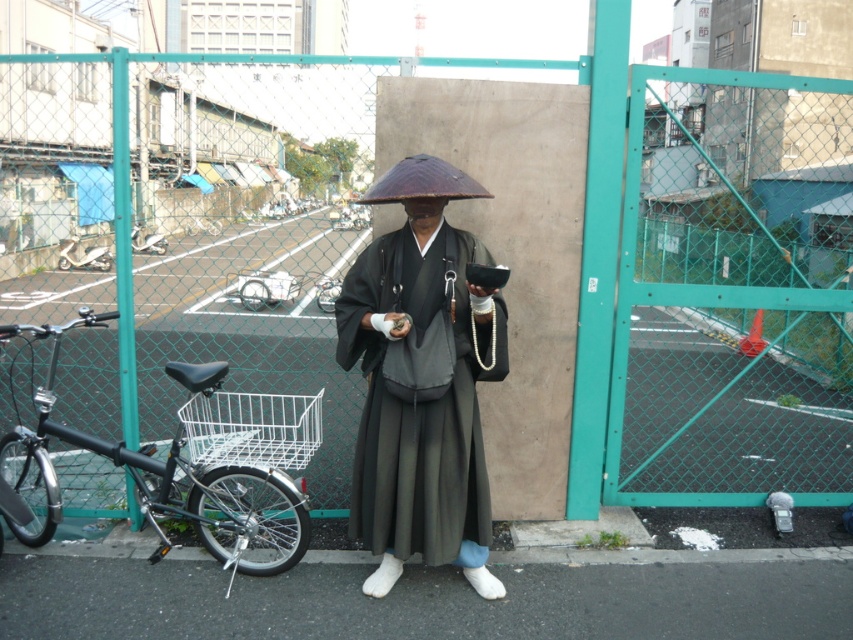
You are a delivery person who needs to reach the shiny brown umbrella at center. You are currently standing 10 feet away from it. Can you just walk straight to it without any obstacles?

The shiny brown umbrella at center and viewer are 10.22 feet apart from each other, so yes, you can walk straight to it as there are no obstacles mentioned in the scene description.

You are a delivery person who needs to place a package between the shiny brown umbrella at center and the silver metallic bicycle at left. Based on their positions, where should you place the package?

The shiny brown umbrella at center is to the right of the silver metallic bicycle at left, so you should place the package between them, to the right of the silver metallic bicycle at left and to the left of the shiny brown umbrella at center.

You are a photographer trying to capture the scene from the camera position. You notice two points marked in the image. Which point, point (4, 156) or point (462, 492), is closer to the camera?

Point (4, 156) is further to the camera than point (462, 492), so the point closer to the camera is point (462, 492).